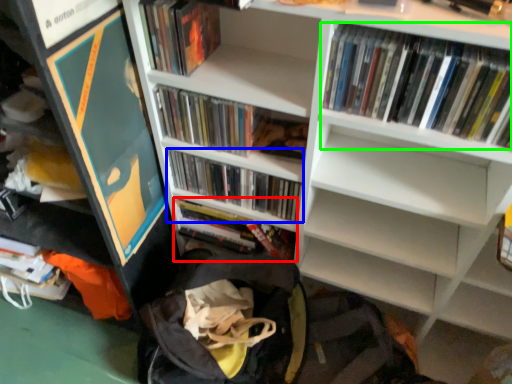
Question: Considering the real-world distances, which object is closest to book (highlighted by a red box)? book (highlighted by a blue box) or book (highlighted by a green box).

Choices:
 (A) book
 (B) book

Answer: (A)